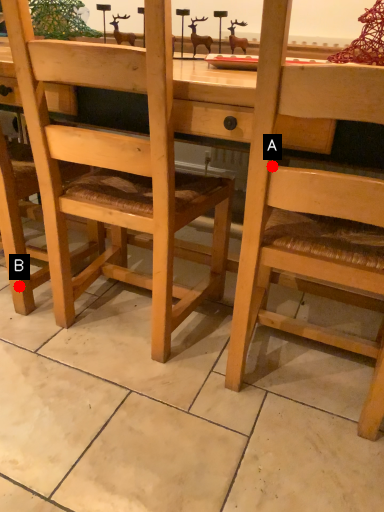
Question: Two points are circled on the image, labeled by A and B beside each circle. Among these points, which one is nearest to the camera?

Choices:
 (A) A is closer
 (B) B is closer

Answer: (A)